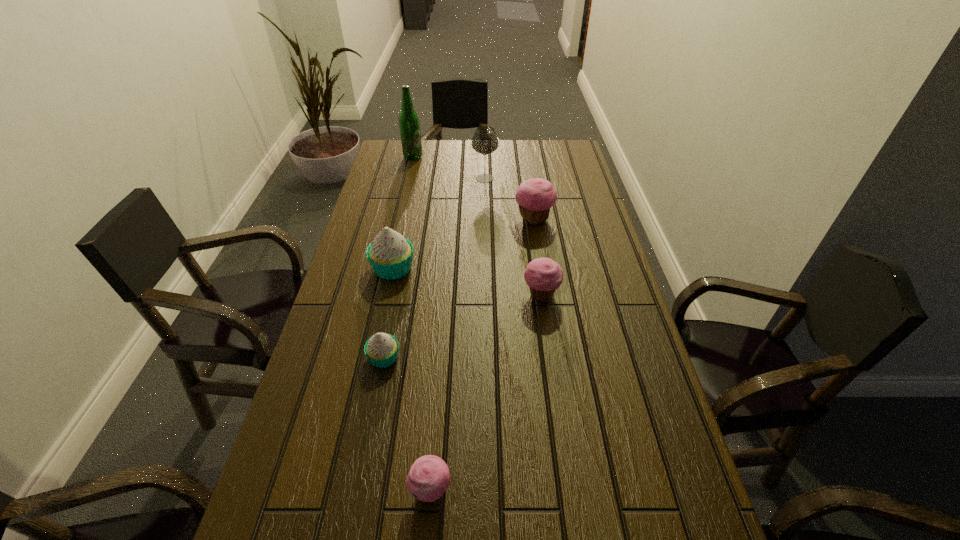
The width and height of the screenshot is (960, 540). In order to click on vacant area between the bigger white cupcake and the green beer bottle in this screenshot , I will do `click(403, 213)`.

The height and width of the screenshot is (540, 960). I want to click on free area in between the nearest cupcake and the biggest pink cupcake, so click(x=482, y=355).

Locate an element on the screen. Image resolution: width=960 pixels, height=540 pixels. vacant area that lies between the farthest cupcake and the farther white cupcake is located at coordinates (464, 244).

Identify the location of free space between the third shortest object and the fifth object from left to right. (513, 237).

Where is `blank region between the sixth shortest object and the smaller white cupcake`? The height and width of the screenshot is (540, 960). blank region between the sixth shortest object and the smaller white cupcake is located at coordinates (434, 268).

Choose which object is the nearest neighbor to the third cupcake from left to right. Please provide its 2D coordinates. Your answer should be formatted as a tuple, i.e. [(x, y)], where the tuple contains the x and y coordinates of a point satisfying the conditions above.

[(381, 349)]

The height and width of the screenshot is (540, 960). In order to click on object identified as the sixth closest to the sixth nearest object in this screenshot , I will do `click(429, 477)`.

Image resolution: width=960 pixels, height=540 pixels. Identify the location of cupcake that is the fourth closest to the third shortest object. (429, 477).

You are a GUI agent. You are given a task and a screenshot of the screen. Output one action in this format:
    pyautogui.click(x=<x>, y=<y>)
    Task: Click on the cupcake object that ranks as the fifth closest to the farthest object
    The width and height of the screenshot is (960, 540).
    Given the screenshot: What is the action you would take?
    pyautogui.click(x=429, y=477)

Locate which pink cupcake ranks second in proximity to the tallest object. Please provide its 2D coordinates. Your answer should be formatted as a tuple, i.e. [(x, y)], where the tuple contains the x and y coordinates of a point satisfying the conditions above.

[(543, 275)]